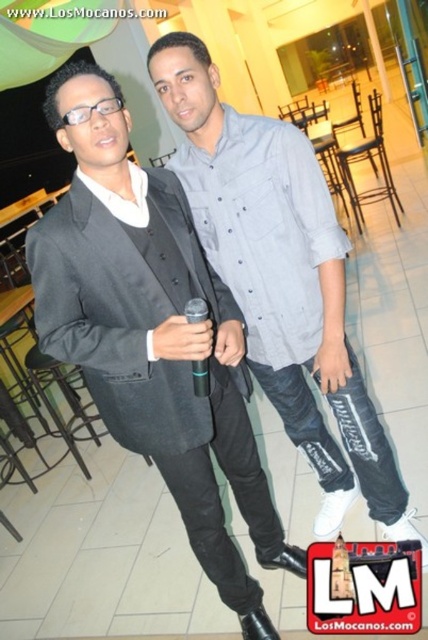
You are at a social event and need to locate two specific points marked in the image. The first point is at coordinates point (x=86, y=166), and the second is at point (x=372, y=488). Which point is closer to the entrance of the room?

Point (x=86, y=166) is in front of point (x=372, y=488), so it is closer to the entrance of the room.

You are at an event and want to approach both the matte black suit at left and the gray cotton shirt at center. Which one should you walk towards first to reach the closer one?

You should walk towards the matte black suit at left first because it is closer to you than the gray cotton shirt at center.